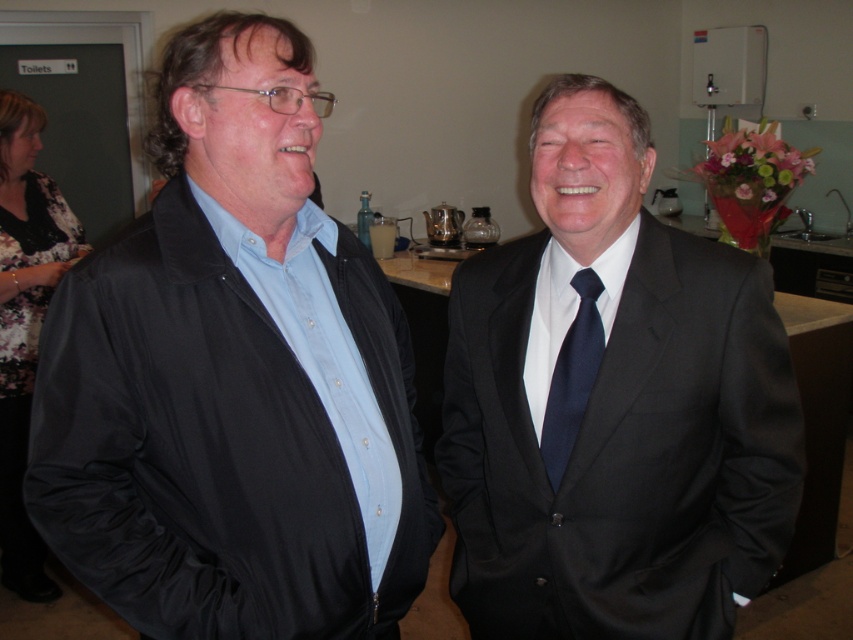
Based on the coordinates provided, which object corresponds to the point at (233, 378)?

The point at (233, 378) corresponds to the matte black jacket at left.

You are organizing a photo shoot and need to arrange two models wearing different black outfits. The first model is wearing a matte black jacket at left, and the second is in a satin black suit at right. Based on the scene description, which outfit is shorter in length?

The matte black jacket at left is shorter than the satin black suit at right.